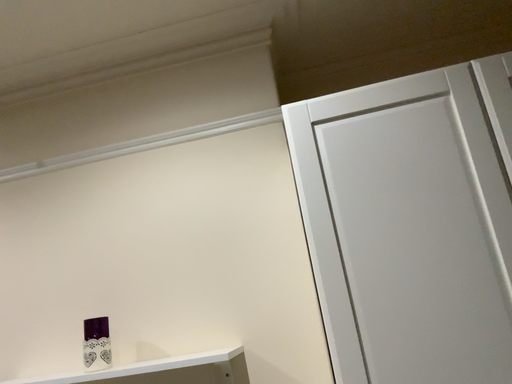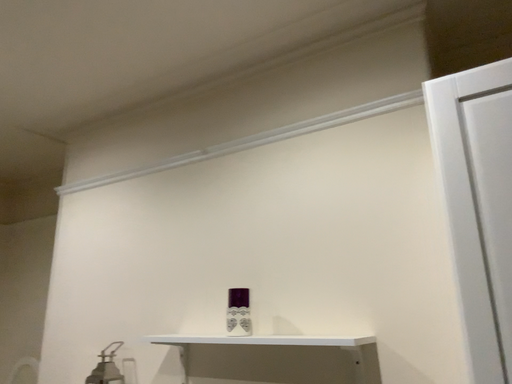
Question: How did the camera likely rotate when shooting the video?

Choices:
 (A) rotated right
 (B) rotated left

Answer: (B)